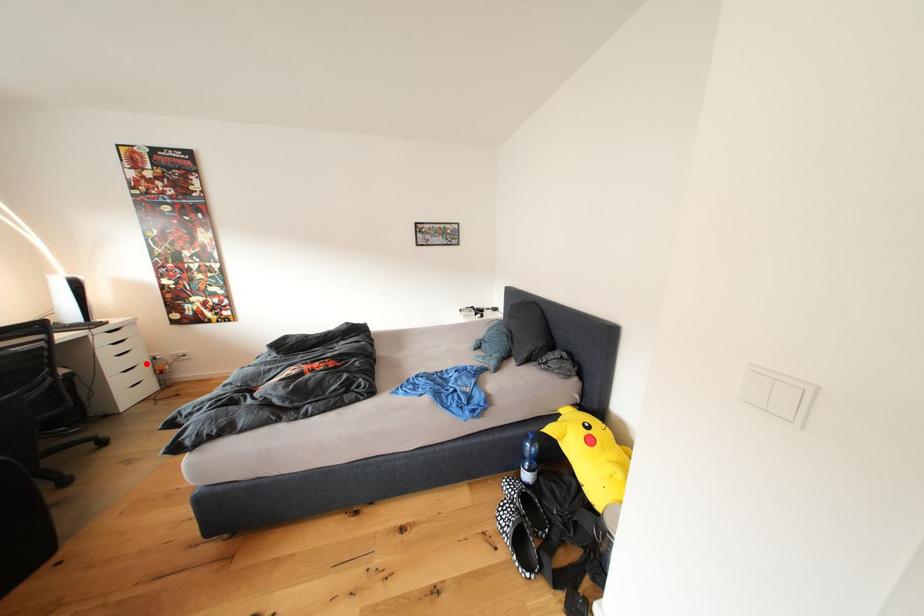
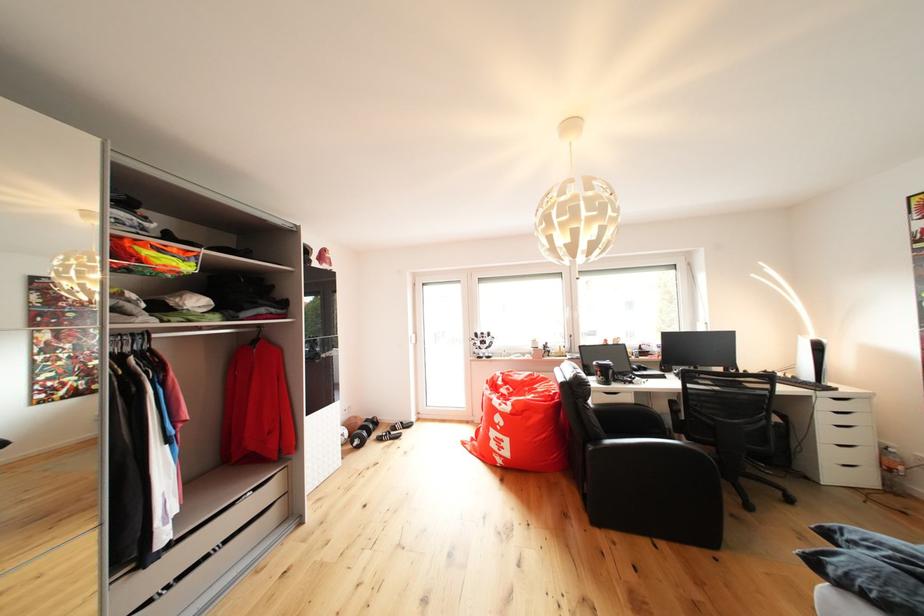
Question: I am providing you with two images of the same scene from different viewpoints. In image1, a red point is highlighted. Considering the same 3D point in image2, which of the following is correct?

Choices:
 (A) It is closer
 (B) It is farther

Answer: (B)